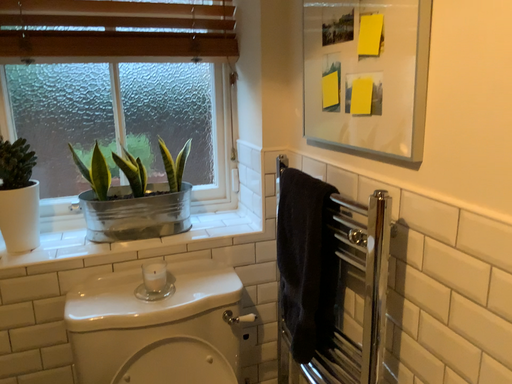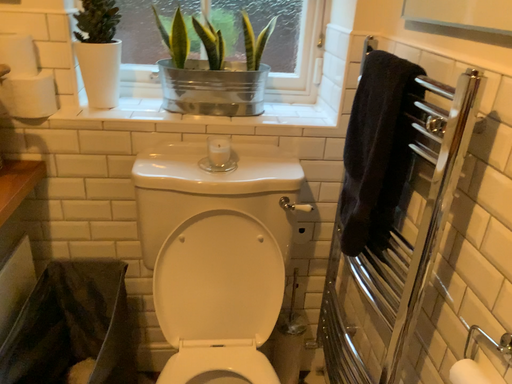
Question: Which way did the camera rotate in the video?

Choices:
 (A) rotated right
 (B) rotated left

Answer: (B)